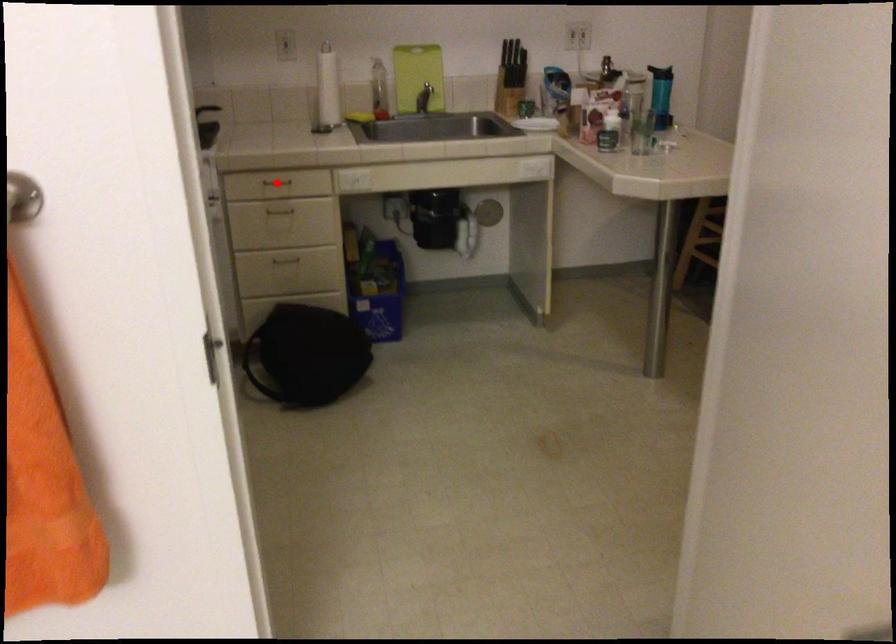
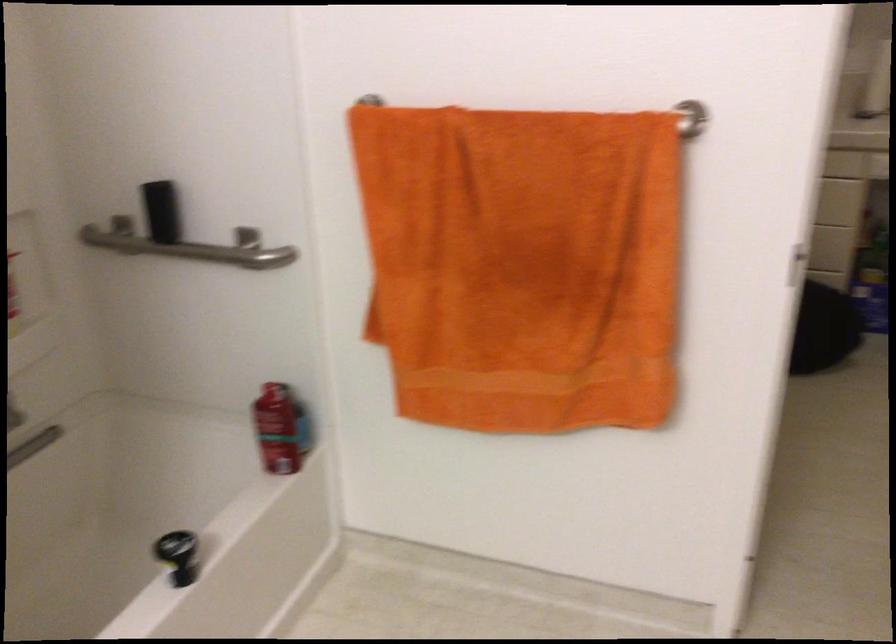
Question: I am providing you with two images of the same scene from different viewpoints. A red point is marked on the first image. At the location where the point appears in image 1, is it still visible in image 2?

Choices:
 (A) Yes
 (B) No

Answer: (B)